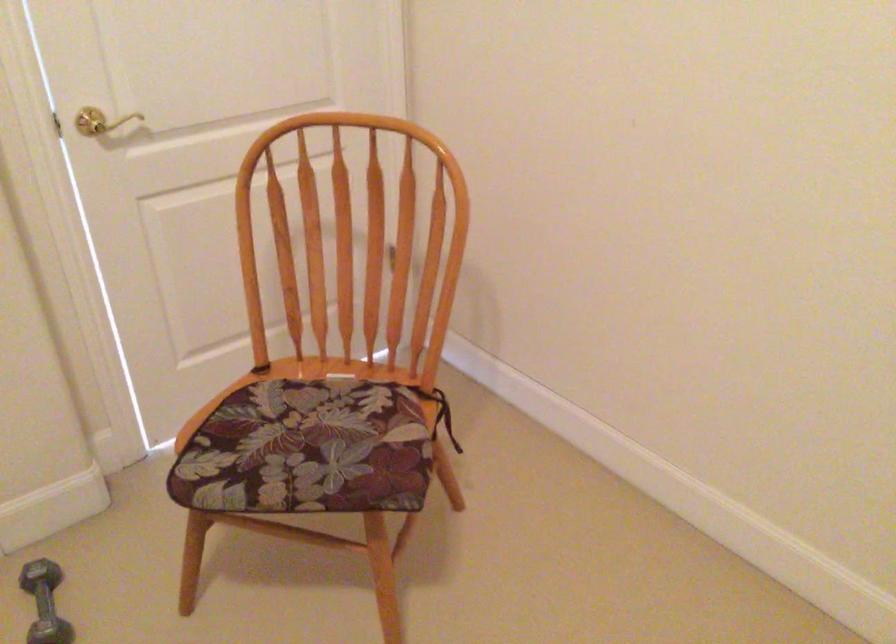
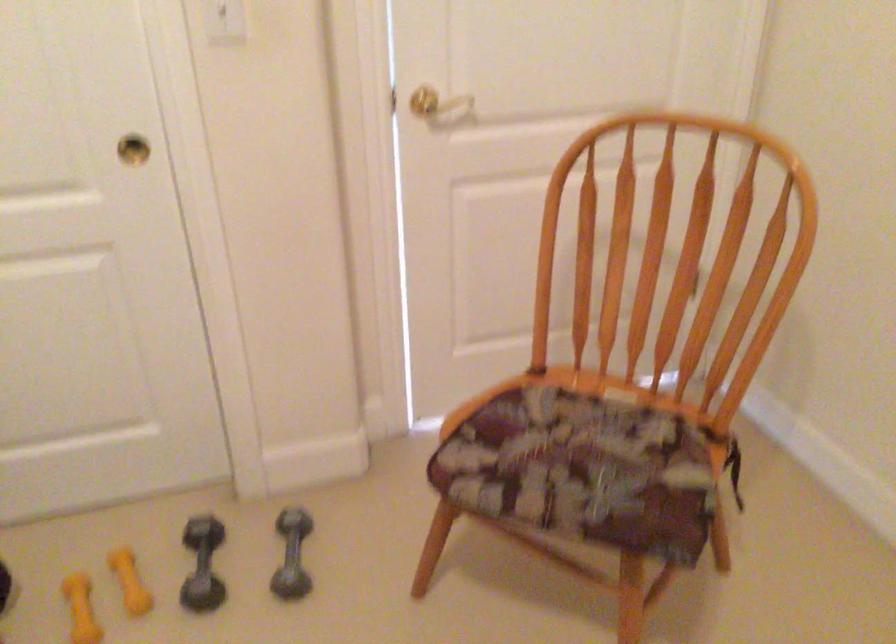
Where in the second image is the point corresponding to [99,127] from the first image?

(424, 102)